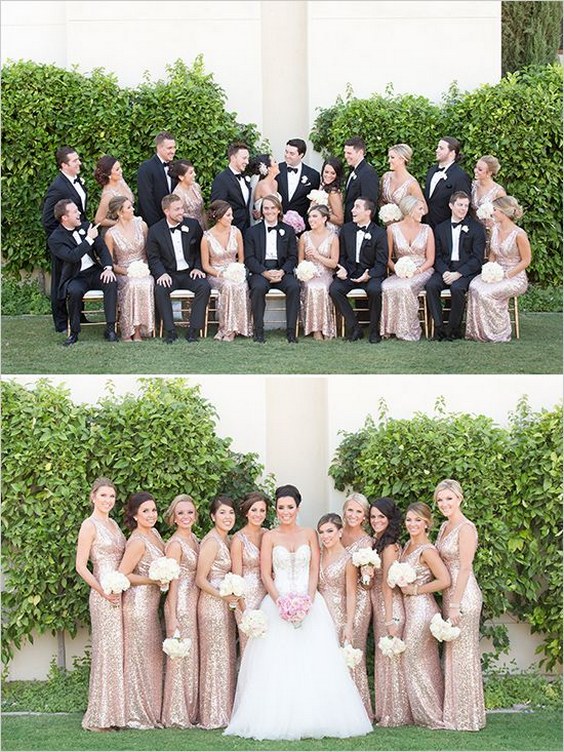
Find the location of a particular element. The height and width of the screenshot is (752, 564). chair cushions is located at coordinates (95, 287), (186, 287), (215, 290), (279, 290), (358, 290), (422, 287), (447, 290).